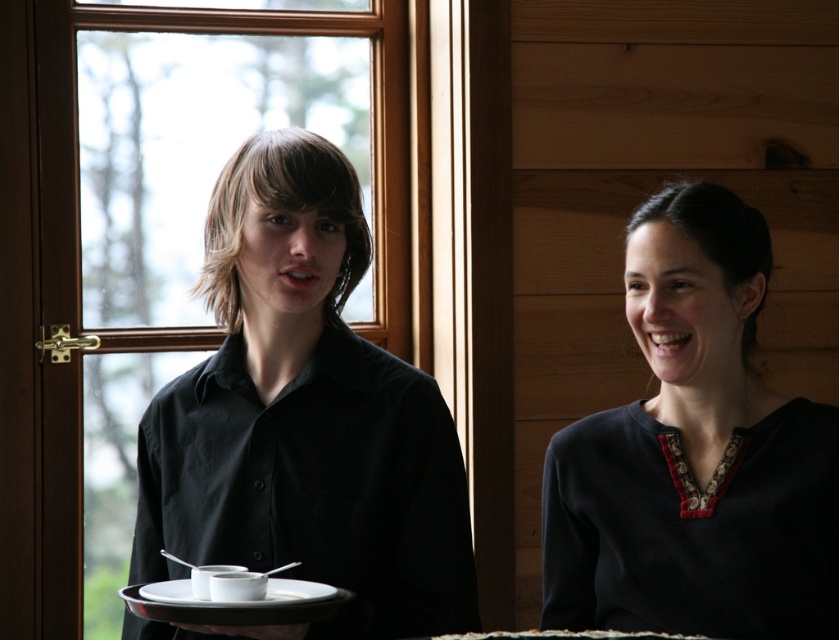
Question: Which object is positioned farthest from the dark blue fabric at center?

Choices:
 (A) white matte saucer at center
 (B) black matte shirt at center

Answer: (A)

Question: In this image, where is dark blue fabric at center located relative to white matte saucer at center?

Choices:
 (A) below
 (B) above

Answer: (B)

Question: Which of the following is the closest to the observer?

Choices:
 (A) (334, 161)
 (B) (248, 579)
 (C) (751, 461)

Answer: (B)

Question: Is black matte shirt at center closer to camera compared to white matte saucer at center?

Choices:
 (A) no
 (B) yes

Answer: (A)

Question: Does black matte shirt at center have a smaller size compared to white matte saucer at center?

Choices:
 (A) yes
 (B) no

Answer: (B)

Question: Which object is farther from the camera taking this photo?

Choices:
 (A) black matte shirt at center
 (B) dark blue fabric at center
 (C) white matte saucer at center

Answer: (B)